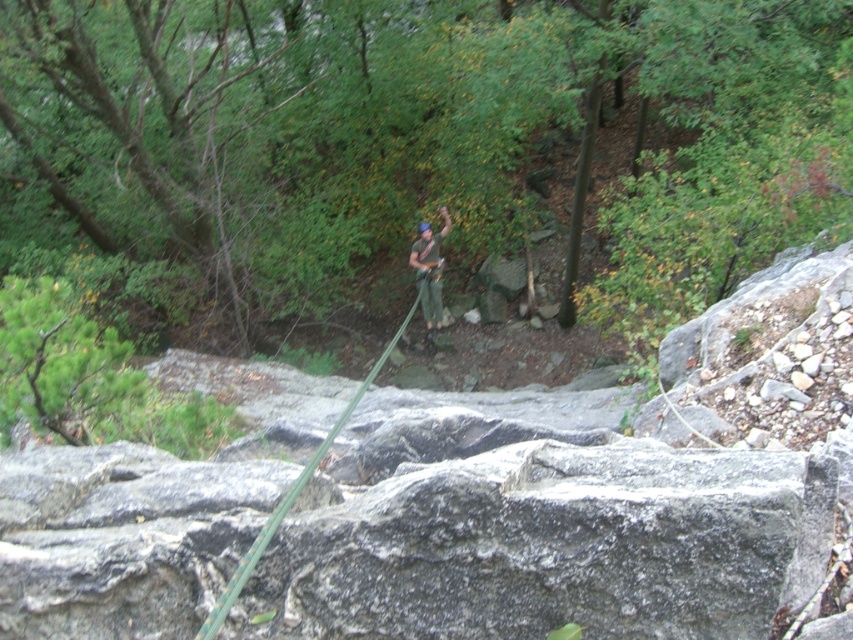
Can you confirm if green leafy tree at center is bigger than green fabric harness at center?

Result: Yes.

Can you confirm if green leafy tree at center is positioned to the right of green fabric harness at center?

Indeed, green leafy tree at center is positioned on the right side of green fabric harness at center.

Find the location of a particular element. This screenshot has width=853, height=640. green leafy tree at center is located at coordinates (367, 116).